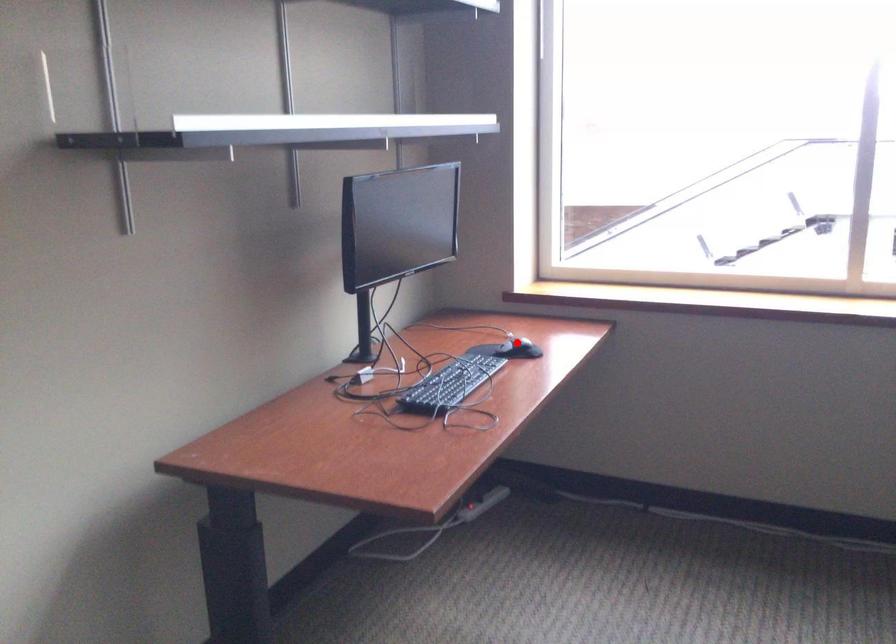
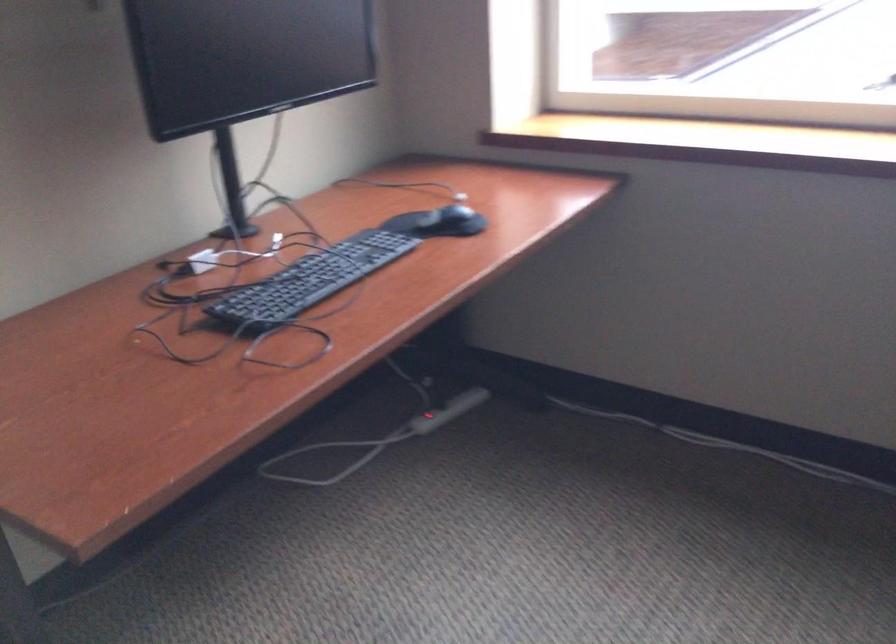
Where in the second image is the point corresponding to the highlighted location from the first image?

(452, 212)